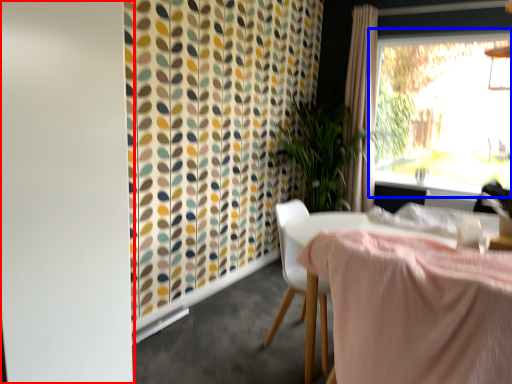
Question: Among these objects, which one is nearest to the camera, screen door (highlighted by a red box) or window (highlighted by a blue box)?

Choices:
 (A) screen door
 (B) window

Answer: (A)